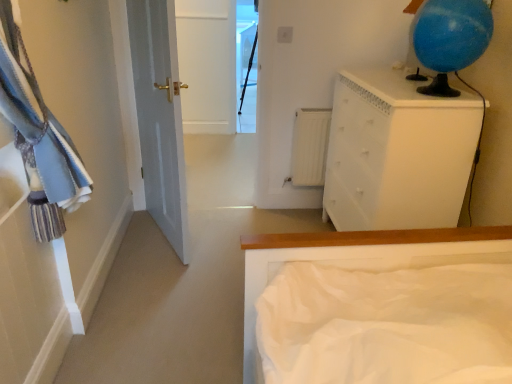
This screenshot has height=384, width=512. What do you see at coordinates (359, 260) in the screenshot? I see `white matte bed at center` at bounding box center [359, 260].

What do you see at coordinates (38, 136) in the screenshot?
I see `blue fabric laundry at left` at bounding box center [38, 136].

Locate an element on the screen. Image resolution: width=512 pixels, height=384 pixels. transparent glass window at center is located at coordinates (246, 64).

Between white painted wood chest of drawers at upper right and transparent glass window at center, which one has smaller size?

transparent glass window at center.

Is white painted wood chest of drawers at upper right touching transparent glass window at center?

No, white painted wood chest of drawers at upper right is not touching transparent glass window at center.

From the picture: How different are the orientations of white painted wood chest of drawers at upper right and transparent glass window at center in degrees?

white painted wood chest of drawers at upper right and transparent glass window at center are facing 86.2 degrees away from each other.

Does point (336, 224) come closer to viewer compared to point (236, 118)?

Yes.

How different are the orientations of white matte radiator at center and transparent glass window at center in degrees?

The facing directions of white matte radiator at center and transparent glass window at center are 4.74 degrees apart.

Which is closer, [311,171] or [242,121]?

Point [311,171] appears to be closer to the viewer than point [242,121].

Is white matte radiator at center outside of transparent glass window at center?

Yes, white matte radiator at center is located beyond the bounds of transparent glass window at center.

Considering the relative positions of white matte radiator at center and transparent glass window at center in the image provided, is white matte radiator at center to the left of transparent glass window at center from the viewer's perspective?

No, white matte radiator at center is not to the left of transparent glass window at center.

Is transparent glass window at center not within blue fabric laundry at left?

Yes, transparent glass window at center is not within blue fabric laundry at left.

Is transparent glass window at center directly adjacent to blue fabric laundry at left?

transparent glass window at center is not next to blue fabric laundry at left, and they're not touching.

Identify the location of window on the right side of blue fabric laundry at left. The width and height of the screenshot is (512, 384). (246, 64).

Which of these two, transparent glass window at center or blue fabric laundry at left, is thinner?

With smaller width is blue fabric laundry at left.

In terms of height, does white painted wood chest of drawers at upper right look taller or shorter compared to white matte radiator at center?

Clearly, white painted wood chest of drawers at upper right is taller compared to white matte radiator at center.

Is white painted wood chest of drawers at upper right outside of white matte radiator at center?

Absolutely, white painted wood chest of drawers at upper right is external to white matte radiator at center.

Does white painted wood chest of drawers at upper right lie in front of white matte radiator at center?

Yes, it is.

Looking at this image, based on their sizes in the image, would you say white painted wood chest of drawers at upper right is bigger or smaller than white matte radiator at center?

Clearly, white painted wood chest of drawers at upper right is larger in size than white matte radiator at center.

Can you confirm if blue fabric laundry at left is positioned to the left of transparent glass window at center?

Yes.

Is blue fabric laundry at left oriented towards transparent glass window at center?

No, blue fabric laundry at left does not turn towards transparent glass window at center.

Considering the sizes of objects blue fabric laundry at left and transparent glass window at center in the image provided, who is shorter, blue fabric laundry at left or transparent glass window at center?

blue fabric laundry at left is shorter.

Consider the image. Does white matte radiator at center have a larger size compared to white painted wood chest of drawers at upper right?

Incorrect, white matte radiator at center is not larger than white painted wood chest of drawers at upper right.

Is white matte radiator at center positioned before white painted wood chest of drawers at upper right?

No.

From the picture: Would you consider white matte radiator at center to be distant from white painted wood chest of drawers at upper right?

white matte radiator at center is actually quite close to white painted wood chest of drawers at upper right.

Considering the points (309, 130) and (428, 225), which point is in front, point (309, 130) or point (428, 225)?

The point (428, 225) is closer to the camera.

In terms of height, does blue fabric laundry at left look taller or shorter compared to white painted wood chest of drawers at upper right?

In the image, blue fabric laundry at left appears to be shorter than white painted wood chest of drawers at upper right.

Is blue fabric laundry at left facing towards white painted wood chest of drawers at upper right?

Yes, blue fabric laundry at left faces towards white painted wood chest of drawers at upper right.

Considering the relative positions of blue fabric laundry at left and white painted wood chest of drawers at upper right in the image provided, is blue fabric laundry at left to the right of white painted wood chest of drawers at upper right from the viewer's perspective?

No, blue fabric laundry at left is not to the right of white painted wood chest of drawers at upper right.

At what (x,y) coordinates should I click in order to perform the action: click on the chest of drawers lying below the transparent glass window at center (from the image's perspective). Please return your answer as a coordinate pair (x, y). The image size is (512, 384). Looking at the image, I should click on (397, 153).

Identify the location of radiator to the right of transparent glass window at center. (310, 146).

When comparing their distances from white matte radiator at center, does transparent glass window at center or white matte bed at center seem closer?

The object closer to white matte radiator at center is white matte bed at center.

In the scene shown: Based on their spatial positions, is transparent glass window at center or white painted wood chest of drawers at upper right closer to blue fabric laundry at left?

Among the two, white painted wood chest of drawers at upper right is located nearer to blue fabric laundry at left.

Which object lies further to the anchor point white matte bed at center, white matte radiator at center or transparent glass window at center?

transparent glass window at center lies further to white matte bed at center than the other object.

Based on the photo, estimate the real-world distances between objects in this image. Which object is closer to transparent glass window at center, white matte bed at center or white painted wood chest of drawers at upper right?

white painted wood chest of drawers at upper right.

Estimate the real-world distances between objects in this image. Which object is closer to transparent glass window at center, blue fabric laundry at left or white matte bed at center?

blue fabric laundry at left is positioned closer to the anchor transparent glass window at center.

From the image, which object appears to be nearer to white painted wood chest of drawers at upper right, blue fabric laundry at left or white matte bed at center?

Among the two, white matte bed at center is located nearer to white painted wood chest of drawers at upper right.

From the image, which object appears to be farther from white matte radiator at center, white matte bed at center or white painted wood chest of drawers at upper right?

white matte bed at center is further to white matte radiator at center.

Estimate the real-world distances between objects in this image. Which object is further from transparent glass window at center, white matte radiator at center or white matte bed at center?

white matte bed at center.

Identify the location of the chest of drawers positioned between white matte bed at center and white matte radiator at center from near to far. point(397,153).

You are a GUI agent. You are given a task and a screenshot of the screen. Output one action in this format:
    pyautogui.click(x=<x>, y=<y>)
    Task: Click on the chest of drawers positioned between blue fabric laundry at left and white matte radiator at center from near to far
    Image resolution: width=512 pixels, height=384 pixels.
    Given the screenshot: What is the action you would take?
    pyautogui.click(x=397, y=153)

Where is `laundry between white matte bed at center and transparent glass window at center in the front-back direction`? laundry between white matte bed at center and transparent glass window at center in the front-back direction is located at coordinates (38, 136).

Where is `radiator located between white matte bed at center and transparent glass window at center in the depth direction`? Image resolution: width=512 pixels, height=384 pixels. radiator located between white matte bed at center and transparent glass window at center in the depth direction is located at coordinates (310, 146).